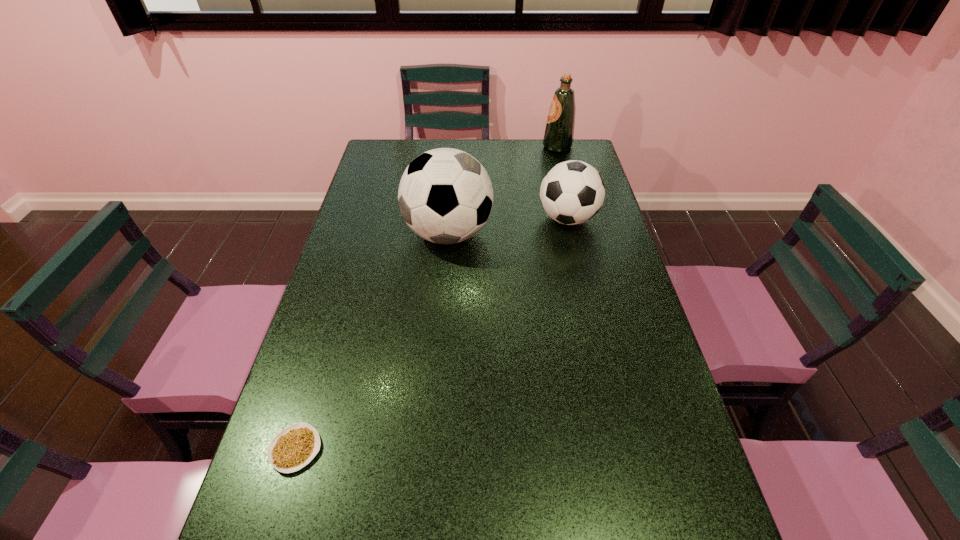
Where is `free space located 0.230m on the main logo of the second object from left to right`? The width and height of the screenshot is (960, 540). free space located 0.230m on the main logo of the second object from left to right is located at coordinates (564, 233).

Identify the location of vacant space located 0.300m on the left of the right soccer ball. tap(447, 219).

The width and height of the screenshot is (960, 540). Identify the location of vacant space located 0.300m on the right of the leftmost object. pos(465,449).

The height and width of the screenshot is (540, 960). In order to click on object positioned at the far edge in this screenshot , I will do `click(559, 134)`.

Where is `object positioned at the left edge`? Image resolution: width=960 pixels, height=540 pixels. object positioned at the left edge is located at coordinates (294, 447).

Find the location of a particular element. The height and width of the screenshot is (540, 960). olive oil present at the right edge is located at coordinates (559, 134).

Find the location of a particular element. Image resolution: width=960 pixels, height=540 pixels. soccer ball that is at the right edge is located at coordinates (572, 192).

Locate an element on the screen. This screenshot has height=540, width=960. object situated at the far right corner is located at coordinates (559, 134).

This screenshot has height=540, width=960. What are the coordinates of `free space at the far edge of the desktop` in the screenshot? It's located at (x=428, y=142).

In the image, there is a desktop. Where is `vacant space at the left edge`? The width and height of the screenshot is (960, 540). vacant space at the left edge is located at coordinates (345, 367).